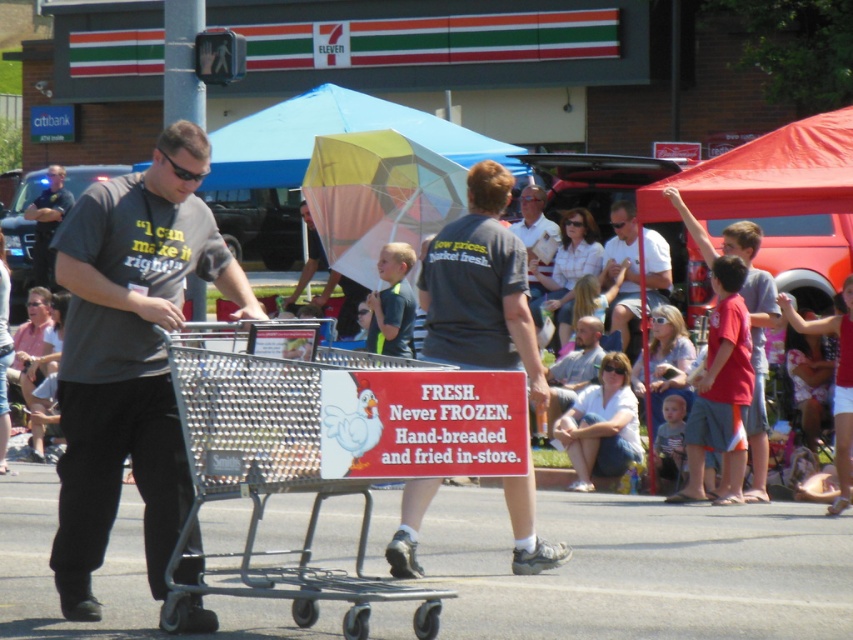
Is the position of white matte shirt at upper center less distant than that of dark gray uniform at left?

Yes, it is in front of dark gray uniform at left.

Who is more forward, (606, 285) or (54, 188)?

Point (606, 285)

Which is behind, point (602, 280) or point (59, 173)?

The point (59, 173) is more distant.

Locate an element on the screen. The width and height of the screenshot is (853, 640). white matte shirt at upper center is located at coordinates (624, 275).

Does silver metallic shopping cart at center lie in front of dark gray t-shirt at center?

Yes, it is in front of dark gray t-shirt at center.

Where is `silver metallic shopping cart at center`? The image size is (853, 640). silver metallic shopping cart at center is located at coordinates (271, 467).

What are the coordinates of `silver metallic shopping cart at center` in the screenshot? It's located at (271, 467).

Is silver metallic shopping cart at center bigger than dark gray uniform at left?

No, silver metallic shopping cart at center is not bigger than dark gray uniform at left.

Which is more to the right, silver metallic shopping cart at center or dark gray uniform at left?

Positioned to the right is silver metallic shopping cart at center.

Which is behind, point (287, 577) or point (47, 195)?

Point (47, 195)

Where is `silver metallic shopping cart at center`? This screenshot has width=853, height=640. silver metallic shopping cart at center is located at coordinates (271, 467).